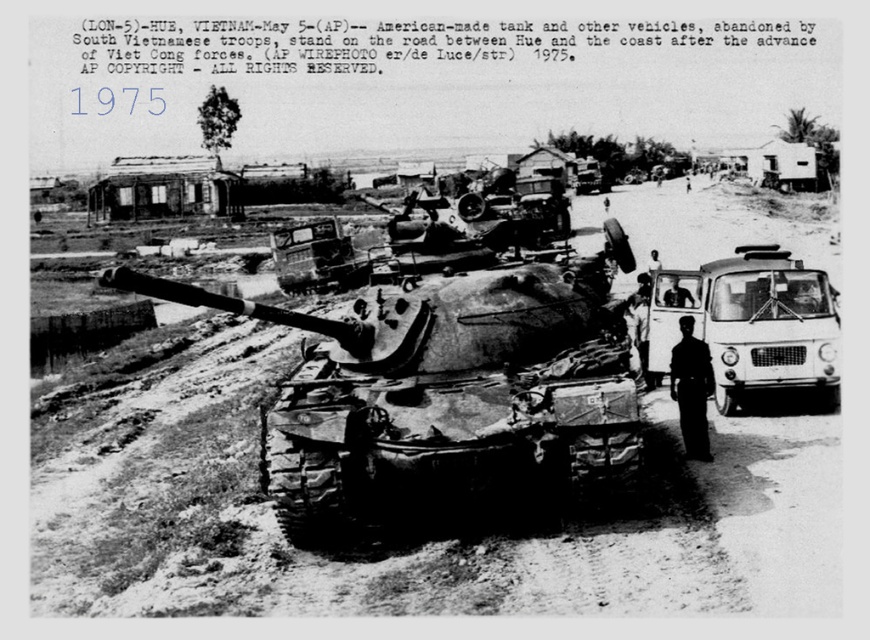
Based on the photo, can you confirm if dark uniform at center is thinner than dark skin human at center?

In fact, dark uniform at center might be wider than dark skin human at center.

Who is more distant from viewer, [679,388] or [676,298]?

Positioned behind is point [676,298].

Which is in front, point (691, 452) or point (683, 304)?

Positioned in front is point (691, 452).

Where is `dark uniform at center`? The height and width of the screenshot is (640, 870). dark uniform at center is located at coordinates (691, 388).

Image resolution: width=870 pixels, height=640 pixels. What do you see at coordinates (442, 388) in the screenshot?
I see `weathered steel tank at center` at bounding box center [442, 388].

Is weathered steel tank at center below dark skin human at center?

No.

The height and width of the screenshot is (640, 870). I want to click on weathered steel tank at center, so click(442, 388).

Is point (524, 380) in front of point (715, 401)?

Yes, point (524, 380) is closer to viewer.

Who is lower down, weathered steel tank at center or white matte van at right?

white matte van at right

In the scene shown: Who is more distant from viewer, (338, 406) or (700, 330)?

The point (700, 330) is behind.

Locate an element on the screen. The width and height of the screenshot is (870, 640). weathered steel tank at center is located at coordinates (442, 388).